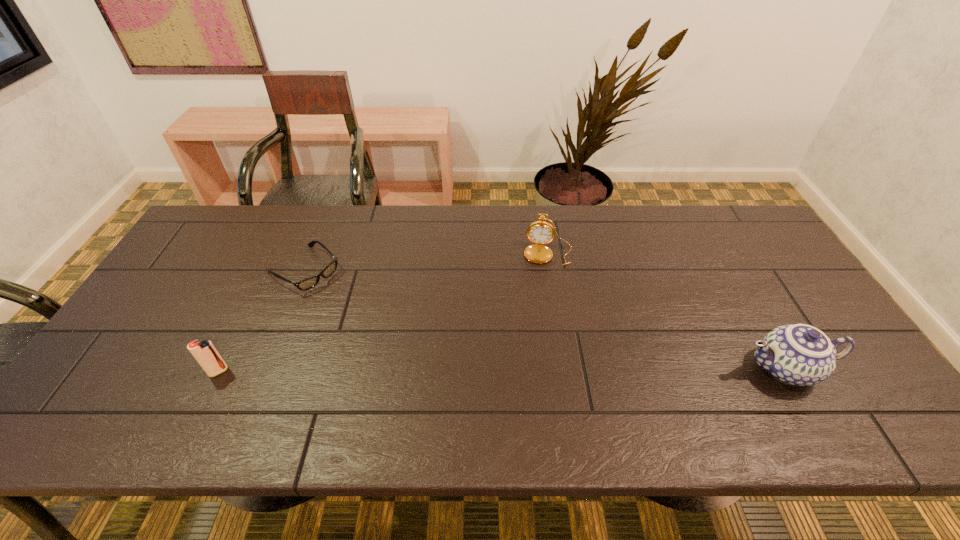
At what (x,y) coordinates should I click in order to perform the action: click on blank area in the image that satisfies the following two spatial constraints: 1. on the front side of the spectacles; 2. from the spout of the chinaware. Please return your answer as a coordinate pair (x, y). This screenshot has height=540, width=960. Looking at the image, I should click on (264, 368).

Find the location of `blank space that satisfies the following two spatial constraints: 1. on the back side of the third object from left to right; 2. on the left side of the spectacles`. blank space that satisfies the following two spatial constraints: 1. on the back side of the third object from left to right; 2. on the left side of the spectacles is located at coordinates (310, 253).